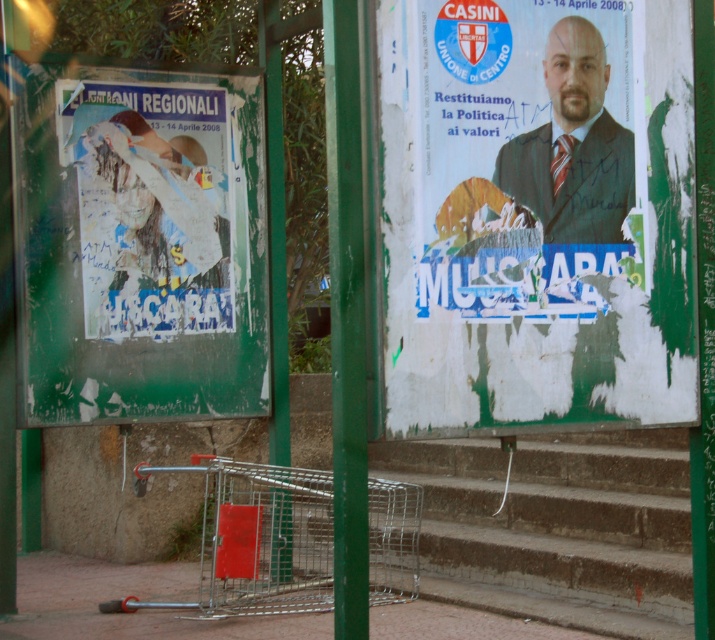
Is scratched paper poster at left to the left of green painted metal pole at center from the viewer's perspective?

Yes, scratched paper poster at left is to the left of green painted metal pole at center.

Does scratched paper poster at left appear under green painted metal pole at center?

No, scratched paper poster at left is not below green painted metal pole at center.

The height and width of the screenshot is (640, 715). I want to click on scratched paper poster at left, so click(x=139, y=243).

Find the location of a particular element. The height and width of the screenshot is (640, 715). metallic silver shopping cart at lower center is located at coordinates (256, 540).

Identify the location of metallic silver shopping cart at lower center. (256, 540).

The width and height of the screenshot is (715, 640). What are the coordinates of `metallic silver shopping cart at lower center` in the screenshot? It's located at (256, 540).

Does concrete stairs at lower center have a greater width compared to white paper poster at left?

Yes, concrete stairs at lower center is wider than white paper poster at left.

From the picture: Which of these two, concrete stairs at lower center or white paper poster at left, stands taller?

With more height is white paper poster at left.

Is point (644, 563) farther from viewer compared to point (147, 88)?

No, (644, 563) is closer to viewer.

Locate an element on the screen. The width and height of the screenshot is (715, 640). concrete stairs at lower center is located at coordinates (557, 525).